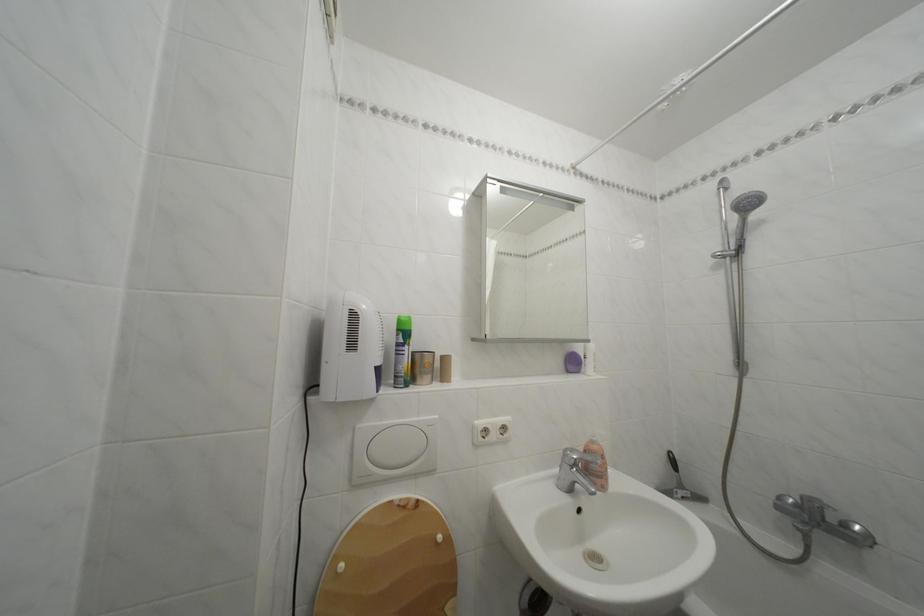
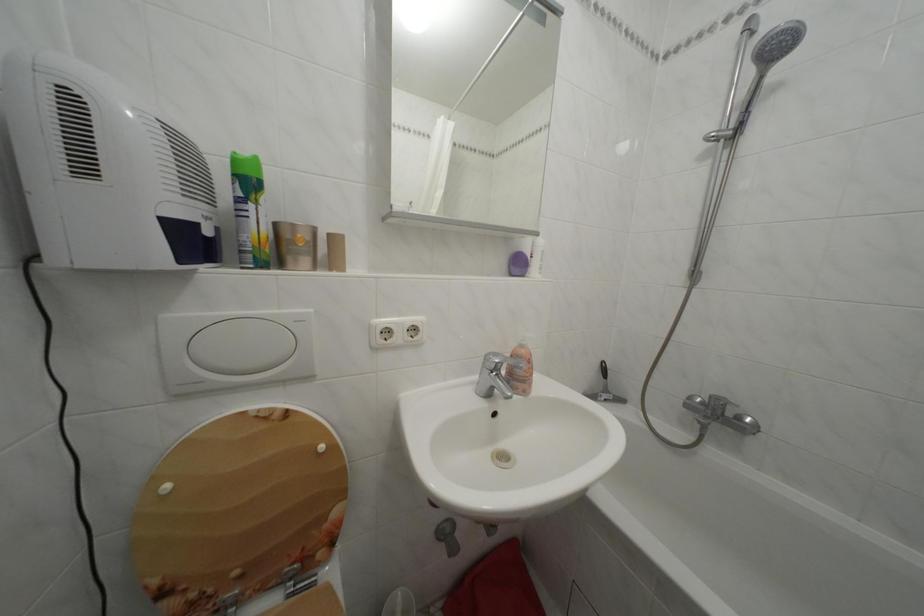
Find the pixel in the second image that matches the point at 368,432 in the first image.

(174, 323)